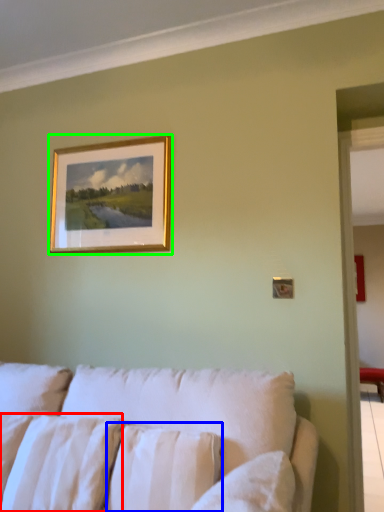
Question: Based on their relative distances, which object is nearer to pillow (highlighted by a red box)? Choose from pillow (highlighted by a blue box) and picture frame (highlighted by a green box).

Choices:
 (A) pillow
 (B) picture frame

Answer: (A)